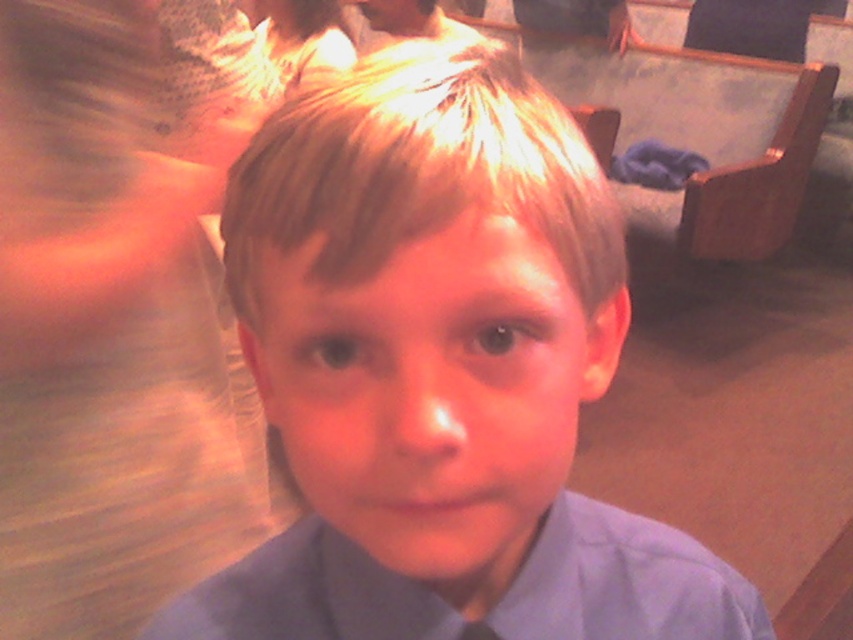
Is point (196, 436) closer to camera compared to point (216, 604)?

No, it is not.

Describe the element at coordinates (119, 312) in the screenshot. I see `light blue fabric at center` at that location.

At what (x,y) coordinates should I click in order to perform the action: click on light blue fabric at center. Please return your answer as a coordinate pair (x, y). Looking at the image, I should click on (119, 312).

Is matte blue shirt at center wider than blonde smooth hair at center?

Yes, matte blue shirt at center is wider than blonde smooth hair at center.

Is matte blue shirt at center bigger than blonde smooth hair at center?

Yes.

At what (x,y) coordinates should I click in order to perform the action: click on matte blue shirt at center. Please return your answer as a coordinate pair (x, y). The height and width of the screenshot is (640, 853). Looking at the image, I should click on (440, 372).

What are the coordinates of `matte blue shirt at center` in the screenshot? It's located at (440, 372).

Does light blue fabric at center have a greater width compared to blonde smooth hair at center?

Yes, light blue fabric at center is wider than blonde smooth hair at center.

The image size is (853, 640). What are the coordinates of `light blue fabric at center` in the screenshot? It's located at (119, 312).

Locate an element on the screen. This screenshot has height=640, width=853. light blue fabric at center is located at coordinates (119, 312).